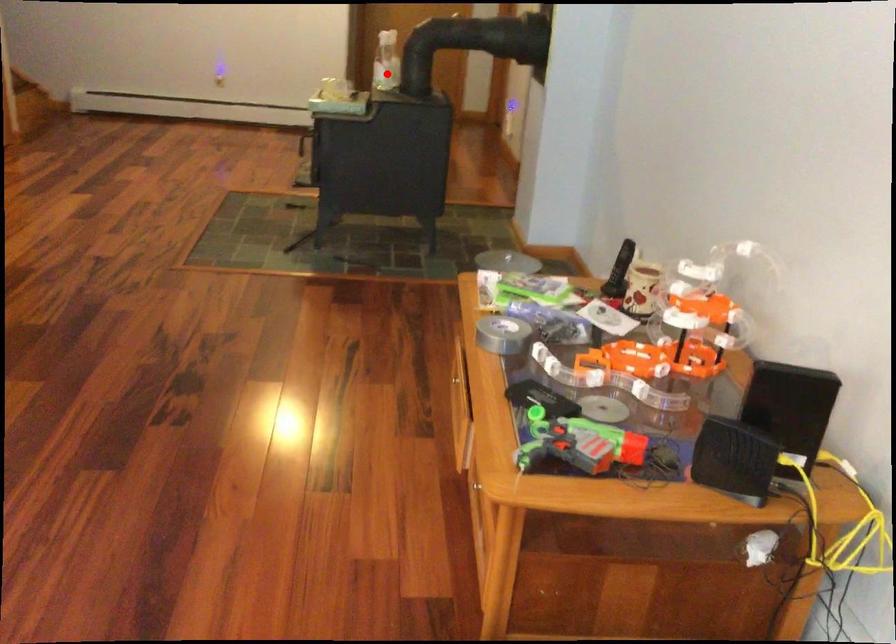
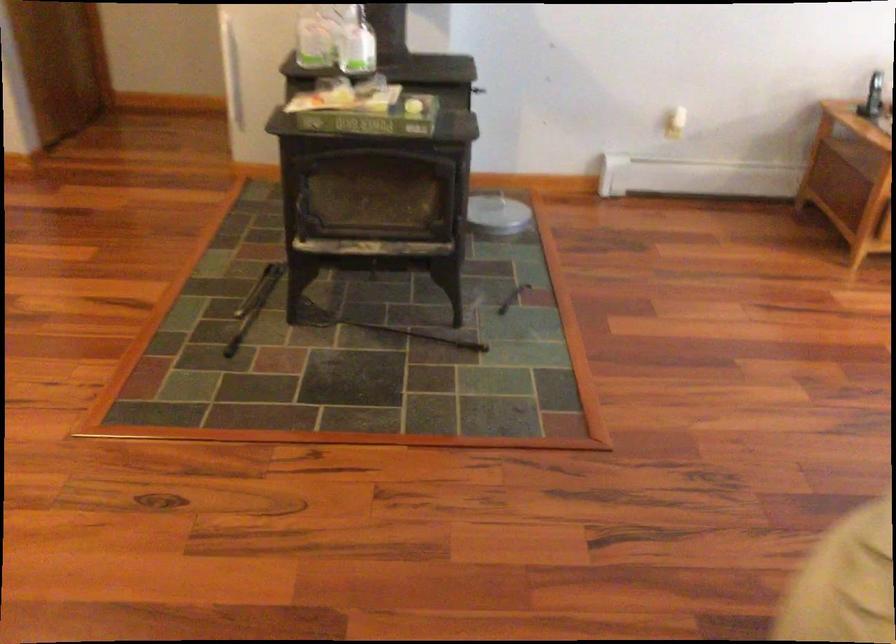
Question: A red point is marked in image1. In image2, is the corresponding 3D point closer to the camera or farther? Reply with the corresponding letter.

Choices:
 (A) The corresponding 3D point is closer.
 (B) The corresponding 3D point is farther.

Answer: (A)